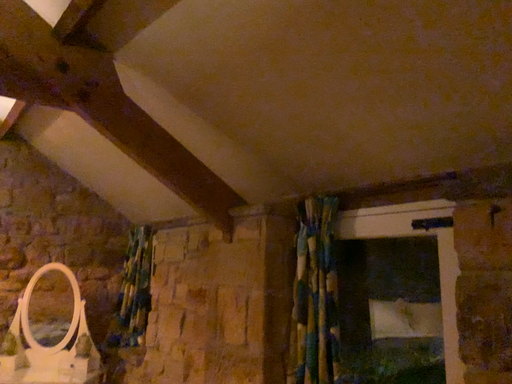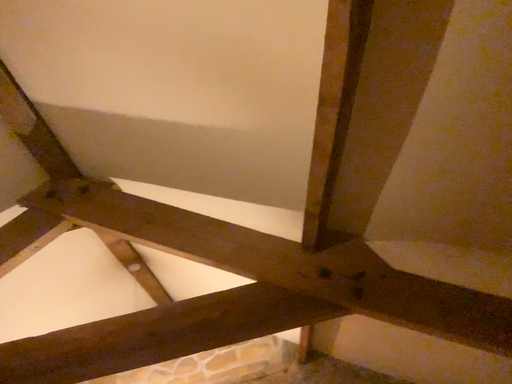
Question: How did the camera likely rotate when shooting the video?

Choices:
 (A) rotated upward
 (B) rotated downward

Answer: (A)